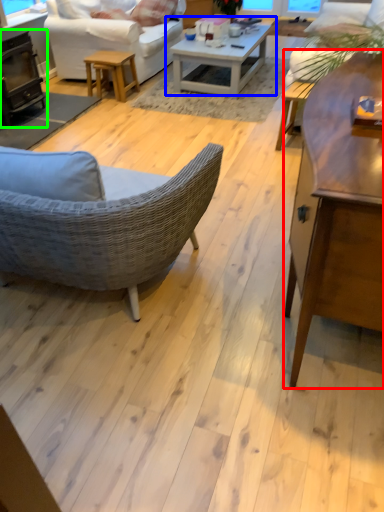
Question: Considering the real-world distances, which object is closest to coffee table (highlighted by a red box)? coffee table (highlighted by a blue box) or fireplace (highlighted by a green box).

Choices:
 (A) coffee table
 (B) fireplace

Answer: (A)